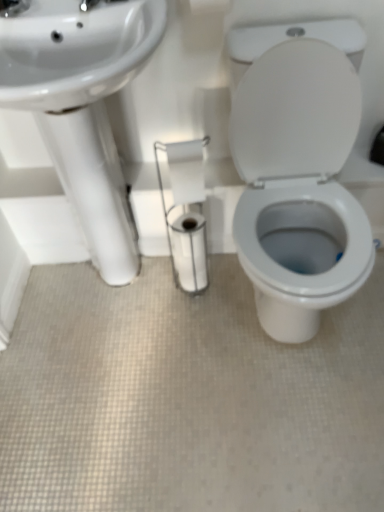
Locate an element on the screen. The width and height of the screenshot is (384, 512). vacant space to the left of white glossy porcelain at center is located at coordinates (166, 346).